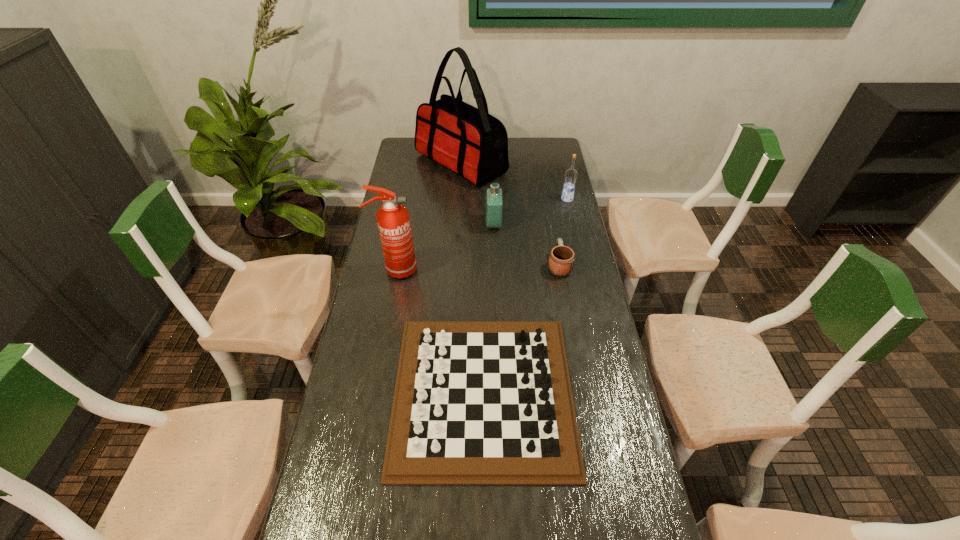
Identify the location of fire extinguisher situated at the left edge. Image resolution: width=960 pixels, height=540 pixels. (393, 220).

The height and width of the screenshot is (540, 960). Identify the location of gameboard that is at the left edge. (476, 402).

This screenshot has width=960, height=540. What are the coordinates of `vodka situated at the right edge` in the screenshot? It's located at (571, 174).

Locate an element on the screen. gameboard at the right edge is located at coordinates (476, 402).

Identify the location of mug located in the right edge section of the desktop. (562, 258).

The width and height of the screenshot is (960, 540). I want to click on object located in the far left corner section of the desktop, so click(469, 141).

The width and height of the screenshot is (960, 540). I want to click on vacant space at the far edge, so click(525, 139).

Locate an element on the screen. The width and height of the screenshot is (960, 540). vacant space at the left edge of the desktop is located at coordinates (387, 402).

Find the location of `vacant space at the right edge`. vacant space at the right edge is located at coordinates (540, 194).

Locate an element on the screen. Image resolution: width=960 pixels, height=540 pixels. free space between the perfume and the mug is located at coordinates (526, 245).